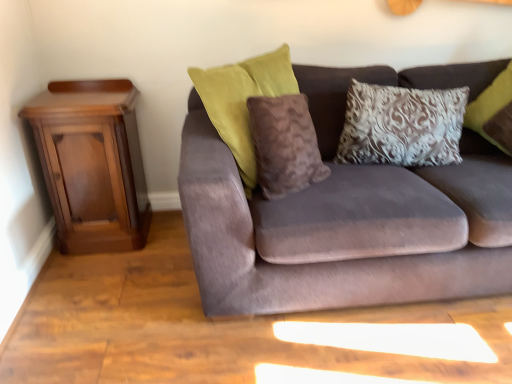
In order to click on free location in front of mahogany wood nightstand at left in this screenshot , I will do `click(92, 285)`.